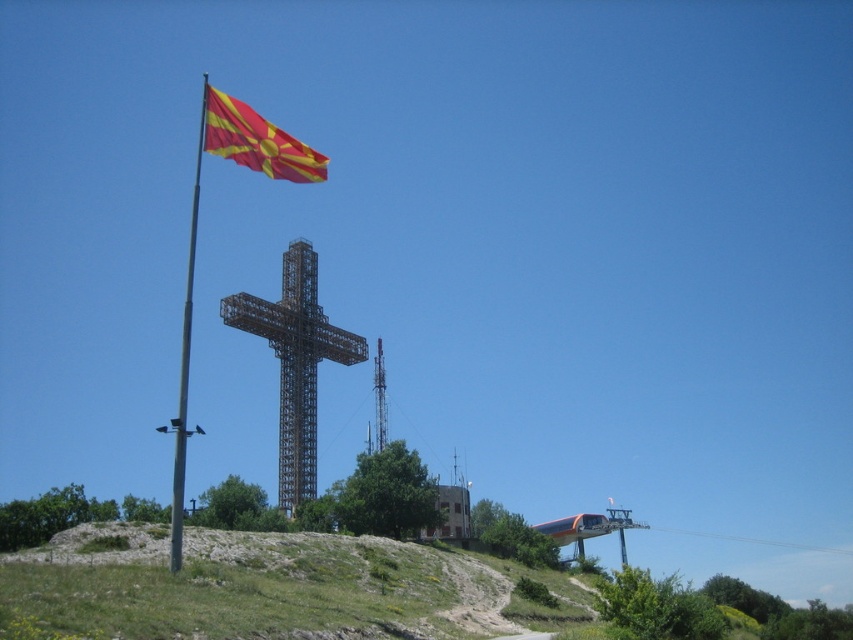
Which of these two, red fabric flag at upper left or metallic flag pole at left, stands taller?

metallic flag pole at left is taller.

In order to click on red fabric flag at upper left in this screenshot , I will do [x=256, y=140].

Locate an element on the screen. The width and height of the screenshot is (853, 640). red fabric flag at upper left is located at coordinates (256, 140).

Does metallic cross at center appear over metallic flag pole at left?

No, metallic cross at center is not above metallic flag pole at left.

Is metallic cross at center further to camera compared to metallic flag pole at left?

Yes, it is.

Is point (299, 502) farther from viewer compared to point (202, 93)?

No, it is not.

You are a GUI agent. You are given a task and a screenshot of the screen. Output one action in this format:
    pyautogui.click(x=<x>, y=<y>)
    Task: Click on the metallic cross at center
    
    Given the screenshot: What is the action you would take?
    pyautogui.click(x=294, y=362)

Describe the element at coordinates (294, 362) in the screenshot. I see `metallic cross at center` at that location.

Does metallic cross at center come in front of red fabric flag at upper left?

No.

Who is more forward, (294,451) or (242,157)?

Positioned in front is point (242,157).

The image size is (853, 640). I want to click on metallic cross at center, so click(x=294, y=362).